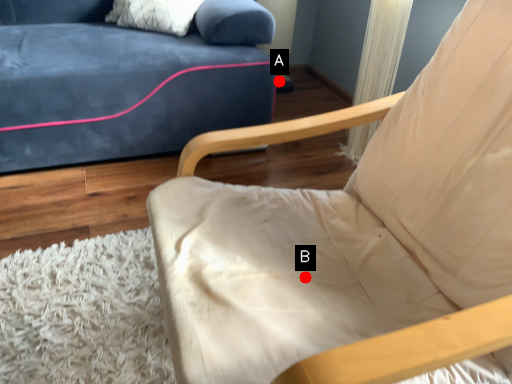
Question: Two points are circled on the image, labeled by A and B beside each circle. Which of the following is the closest to the observer?

Choices:
 (A) A is closer
 (B) B is closer

Answer: (B)